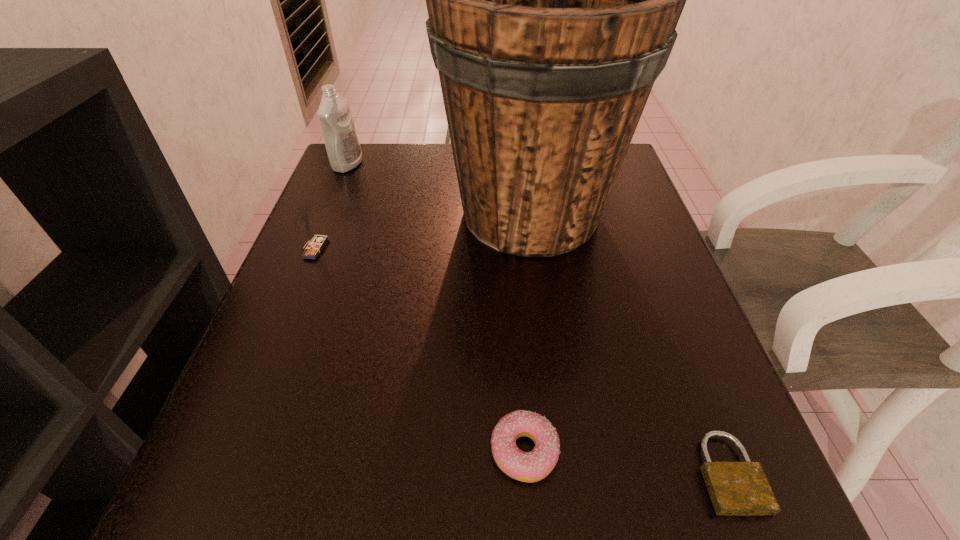
This screenshot has width=960, height=540. What are the coordinates of `free spot at the far edge of the desktop` in the screenshot? It's located at pyautogui.click(x=443, y=180).

Identify the location of free space at the near edge. The height and width of the screenshot is (540, 960). (593, 479).

The image size is (960, 540). What are the coordinates of `vacant area at the left edge of the desktop` in the screenshot? It's located at (363, 291).

Find the location of a particular element. The width and height of the screenshot is (960, 540). free space at the right edge of the desktop is located at coordinates (692, 367).

In the image, there is a desktop. Identify the location of free space at the far left corner. The image size is (960, 540). point(344,181).

In the image, there is a desktop. At what (x,y) coordinates should I click in order to perform the action: click on blank space at the near right corner. Please return your answer as a coordinate pair (x, y). This screenshot has height=540, width=960. Looking at the image, I should click on (699, 499).

This screenshot has height=540, width=960. What are the coordinates of `vacant point located between the second tallest object and the tallest object` in the screenshot? It's located at (439, 188).

The image size is (960, 540). I want to click on free spot between the shortest object and the detergent, so pyautogui.click(x=538, y=319).

The height and width of the screenshot is (540, 960). I want to click on blank region between the tallest object and the matchbox, so click(x=422, y=231).

Find the location of a particular element. free spot between the matchbox and the bucket is located at coordinates (422, 231).